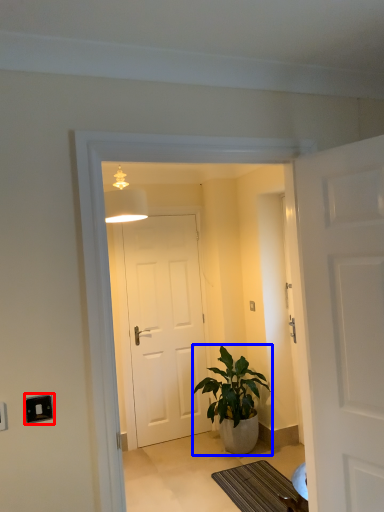
Question: Which object appears closest to the camera in this image, electric outlet (highlighted by a red box) or houseplant (highlighted by a blue box)?

Choices:
 (A) electric outlet
 (B) houseplant

Answer: (A)